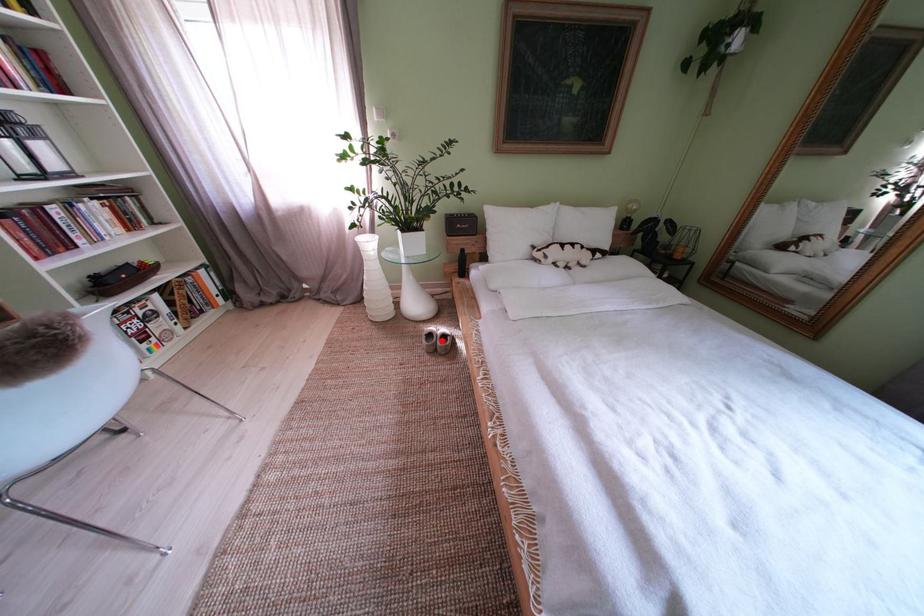
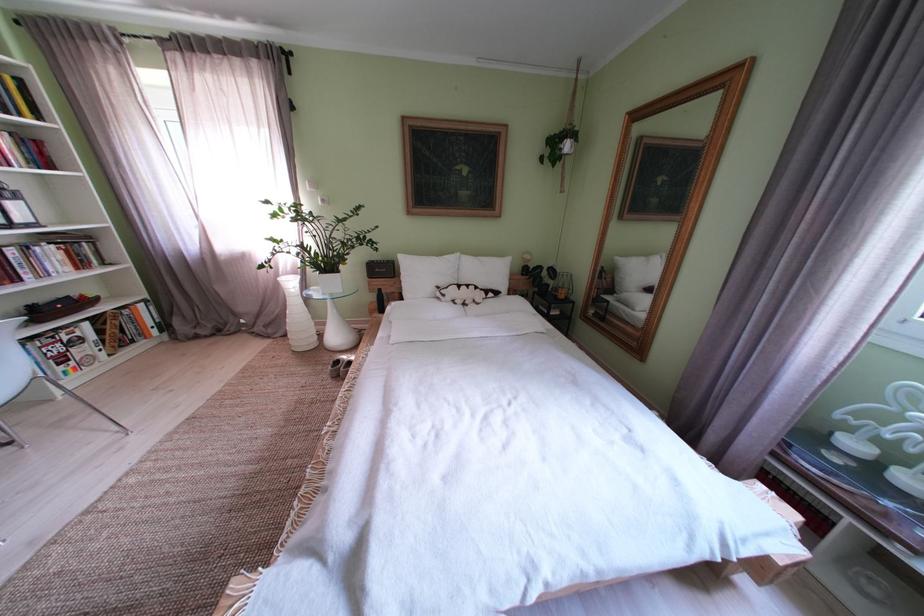
In the second image, find the point that corresponds to the highlighted location in the first image.

(348, 367)